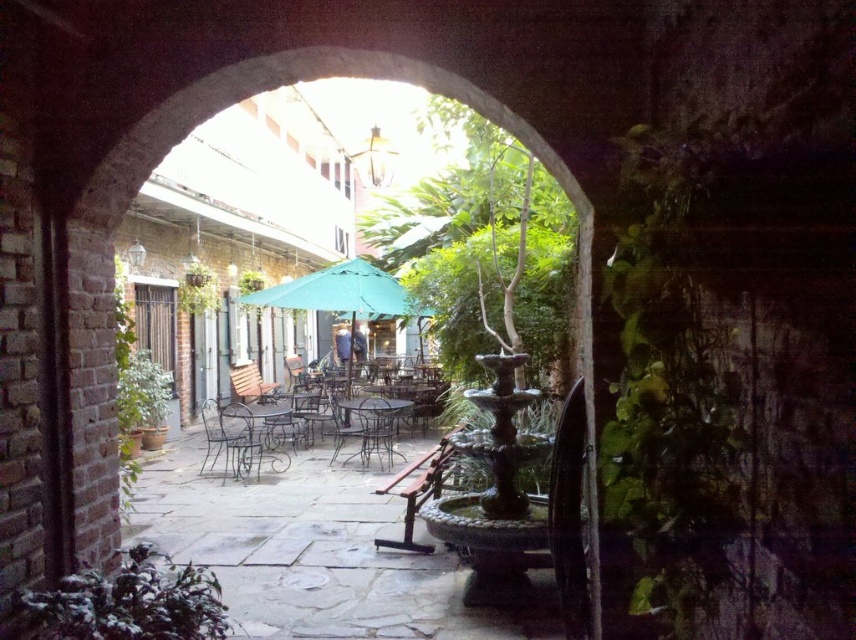
You are sitting at the metallic silver chair at center in the courtyard. You want to place a book on the metallic wrought iron table at center. Which direction should you move to reach the table?

The metallic wrought iron table at center is positioned on the left side of the metallic silver chair at center, so you should move to your left to reach the table.

Consider the image. You are sitting at the metallic black chair at center in the courtyard. Where is the metallic wrought iron table at center located relative to your chair?

The metallic wrought iron table at center is positioned under the metallic black chair at center, meaning the chair is above the table.

You are standing in the courtyard and see two points marked in the scene. Which point is closer to you, point [260,438] or point [366,454]?

Point [260,438] is closer to you because it is further to the viewer than point [366,454].